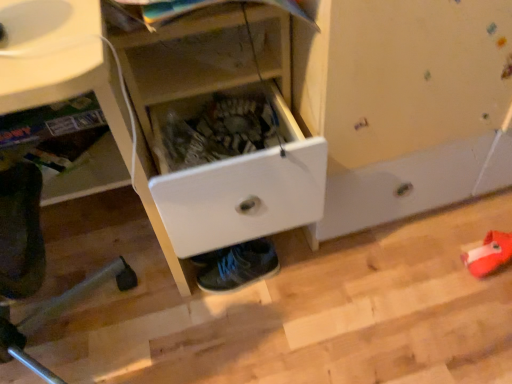
The image size is (512, 384). Find the location of `free region under white plastic drawer at lower center (from a real-world perspective)`. free region under white plastic drawer at lower center (from a real-world perspective) is located at coordinates (77, 338).